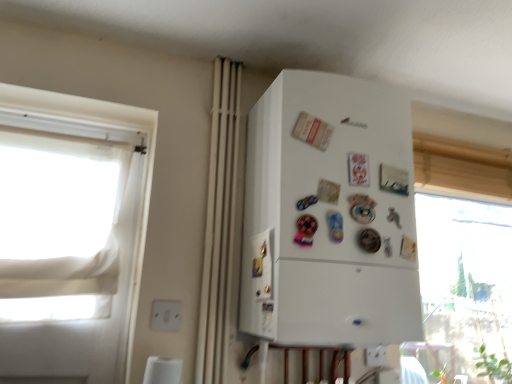
What do you see at coordinates (329, 215) in the screenshot?
I see `white matte refrigerator at center` at bounding box center [329, 215].

What do you see at coordinates (376, 356) in the screenshot? I see `white plastic electric outlet at lower center, which is counted as the 1th electric outlet, starting from the bottom` at bounding box center [376, 356].

Locate an element on the screen. This screenshot has width=512, height=384. white plastic electric outlet at lower left, the first electric outlet from the front is located at coordinates (166, 315).

The image size is (512, 384). What are the coordinates of `white matte curtain at center` in the screenshot? It's located at (219, 224).

Considering the points (375, 354) and (53, 350), which point is in front, point (375, 354) or point (53, 350)?

Point (53, 350)

Which of these two, white plastic electric outlet at lower center, the 2th electric outlet positioned from the front, or white fabric window at left, is bigger?

With larger size is white fabric window at left.

Considering the positions of objects white plastic electric outlet at lower center, the 1th electric outlet when ordered from back to front, and white fabric window at left in the image provided, who is more to the right, white plastic electric outlet at lower center, the 1th electric outlet when ordered from back to front, or white fabric window at left?

white plastic electric outlet at lower center, the 1th electric outlet when ordered from back to front, is more to the right.

Are white plastic electric outlet at lower left, which is the first electric outlet in top-to-bottom order, and white fabric window at left making contact?

white plastic electric outlet at lower left, which is the first electric outlet in top-to-bottom order, and white fabric window at left are not in contact.

Is white plastic electric outlet at lower left, positioned as the first electric outlet in left-to-right order, oriented towards white fabric window at left?

No.

Locate an element on the screen. the 1st electric outlet positioned below the white fabric window at left (from the image's perspective) is located at coordinates (166, 315).

Which of these two, white fabric window at left or white plastic electric outlet at lower center, the 2th electric outlet positioned from the front, is bigger?

white fabric window at left is bigger.

From the image's perspective, is white fabric window at left above or below white plastic electric outlet at lower center, the 1th electric outlet when ordered from back to front?

Based on their image positions, white fabric window at left is located above white plastic electric outlet at lower center, the 1th electric outlet when ordered from back to front.

Is white plastic electric outlet at lower center, the 2th electric outlet in the left-to-right sequence, surrounded by white fabric window at left?

Actually, white plastic electric outlet at lower center, the 2th electric outlet in the left-to-right sequence, is outside white fabric window at left.

Is point (4, 219) in front of point (386, 348)?

Yes, it is in front of point (386, 348).

Which object is thinner, white matte refrigerator at center or white fabric window at left?

With smaller width is white fabric window at left.

Is white matte refrigerator at center to the right of white fabric window at left from the viewer's perspective?

Yes, white matte refrigerator at center is to the right of white fabric window at left.

Is white matte refrigerator at center bigger than white fabric window at left?

Correct, white matte refrigerator at center is larger in size than white fabric window at left.

Can you confirm if white matte curtain at center is positioned to the left of white matte refrigerator at center?

Yes.

This screenshot has width=512, height=384. In order to click on curtain above the white matte refrigerator at center (from a real-world perspective) in this screenshot , I will do `click(219, 224)`.

From their relative heights in the image, would you say white matte curtain at center is taller or shorter than white matte refrigerator at center?

Clearly, white matte curtain at center is taller compared to white matte refrigerator at center.

Does white matte curtain at center turn towards white matte refrigerator at center?

No, white matte curtain at center is not oriented towards white matte refrigerator at center.

Does white plastic electric outlet at lower left, which is the 2th electric outlet from back to front, have a smaller size compared to white matte refrigerator at center?

Yes, white plastic electric outlet at lower left, which is the 2th electric outlet from back to front, is smaller than white matte refrigerator at center.

From a real-world perspective, is white plastic electric outlet at lower left, placed as the second electric outlet when sorted from right to left, physically below white matte refrigerator at center?

Yes, from a real-world perspective, white plastic electric outlet at lower left, placed as the second electric outlet when sorted from right to left, is under white matte refrigerator at center.

Is white plastic electric outlet at lower left, placed as the second electric outlet when sorted from right to left, positioned in front of white matte refrigerator at center?

No.

Find the location of a particular element. This screenshot has width=512, height=384. refrigerator that appears in front of the white plastic electric outlet at lower left, positioned as the first electric outlet in left-to-right order is located at coordinates (329, 215).

Is white matte refrigerator at center touching white plastic electric outlet at lower center, which is counted as the 1th electric outlet, starting from the right?

No, white matte refrigerator at center is not touching white plastic electric outlet at lower center, which is counted as the 1th electric outlet, starting from the right.

Is point (294, 116) positioned before point (372, 360)?

Yes, it is in front of point (372, 360).

Based on the photo, which of these two, white matte refrigerator at center or white plastic electric outlet at lower center, the 2th electric outlet positioned from the front, is wider?

white matte refrigerator at center.

Is white plastic electric outlet at lower center, the 2th electric outlet positioned from the front, a part of white matte refrigerator at center?

Actually, white plastic electric outlet at lower center, the 2th electric outlet positioned from the front, is outside white matte refrigerator at center.

Starting from the white fabric window at left, which electric outlet is the 2nd one to the right? Please provide its 2D coordinates.

[(376, 356)]

Identify the location of window above the white plastic electric outlet at lower left, placed as the second electric outlet when sorted from right to left (from the image's perspective). pos(67,234).

From the image, which object appears to be farther from white plastic electric outlet at lower left, positioned as the first electric outlet in left-to-right order, white fabric window at left or white matte curtain at center?

Among the two, white fabric window at left is located further to white plastic electric outlet at lower left, positioned as the first electric outlet in left-to-right order.

Which object lies further to the anchor point white plastic electric outlet at lower center, the 2th electric outlet in the left-to-right sequence, white plastic electric outlet at lower left, which is the first electric outlet in top-to-bottom order, or white fabric window at left?

white fabric window at left.

Considering their positions, is white matte curtain at center positioned closer to white matte refrigerator at center than white plastic electric outlet at lower center, which is counted as the 1th electric outlet, starting from the right?

Based on the image, white matte curtain at center appears to be nearer to white matte refrigerator at center.

Looking at the image, which one is located further to white fabric window at left, white matte curtain at center or white matte refrigerator at center?

Among the two, white matte refrigerator at center is located further to white fabric window at left.

Based on their spatial positions, is white matte refrigerator at center or white matte curtain at center closer to white plastic electric outlet at lower left, positioned as the first electric outlet in left-to-right order?

white matte curtain at center is closer to white plastic electric outlet at lower left, positioned as the first electric outlet in left-to-right order.

From the image, which object appears to be nearer to white matte refrigerator at center, white plastic electric outlet at lower center, the 1th electric outlet when ordered from back to front, or white fabric window at left?

white fabric window at left.

Based on their spatial positions, is white plastic electric outlet at lower left, the first electric outlet from the front, or white matte curtain at center further from white fabric window at left?

Among the two, white plastic electric outlet at lower left, the first electric outlet from the front, is located further to white fabric window at left.

Considering their positions, is white plastic electric outlet at lower center, which is counted as the 2th electric outlet, starting from the top, positioned further to white matte refrigerator at center than white plastic electric outlet at lower left, the first electric outlet from the front?

The object further to white matte refrigerator at center is white plastic electric outlet at lower center, which is counted as the 2th electric outlet, starting from the top.

This screenshot has height=384, width=512. Identify the location of electric outlet between white fabric window at left and white plastic electric outlet at lower center, the 1th electric outlet when ordered from back to front, in the horizontal direction. click(x=166, y=315).

Identify the location of electric outlet located between white fabric window at left and white matte refrigerator at center in the left-right direction. The width and height of the screenshot is (512, 384). (166, 315).

Locate an element on the screen. The image size is (512, 384). curtain located between white plastic electric outlet at lower left, which is the 2th electric outlet from back to front, and white plastic electric outlet at lower center, the 2th electric outlet in the left-to-right sequence, in the left-right direction is located at coordinates (219, 224).

This screenshot has height=384, width=512. I want to click on curtain located between white fabric window at left and white plastic electric outlet at lower center, which is counted as the 1th electric outlet, starting from the right, in the left-right direction, so click(x=219, y=224).